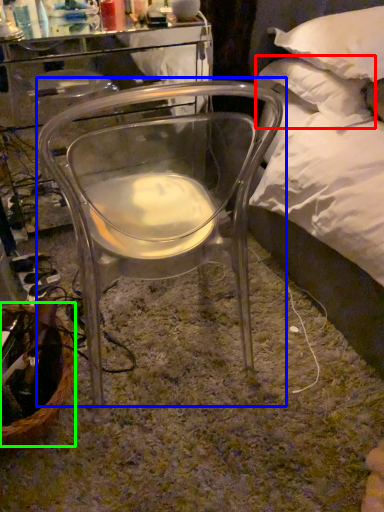
Question: Which is nearer to the pillow (highlighted by a red box)? chair (highlighted by a blue box) or basket (highlighted by a green box).

Choices:
 (A) chair
 (B) basket

Answer: (A)